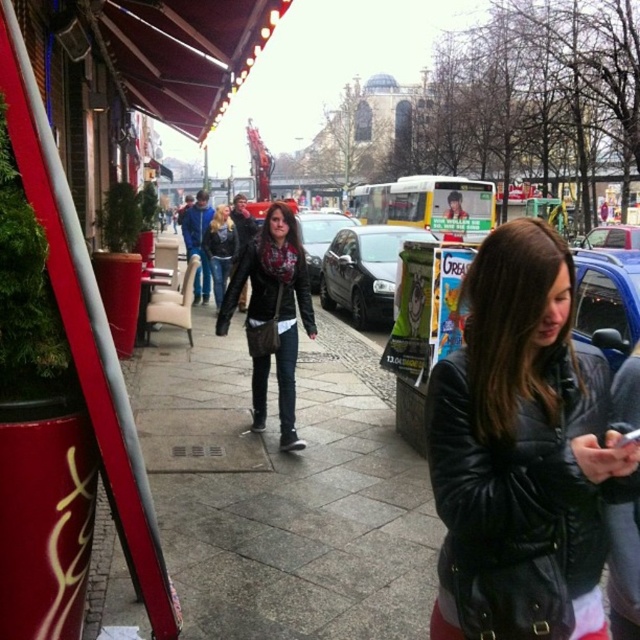
Does matte black scarf at center have a smaller size compared to shiny black car at center?

Correct, matte black scarf at center occupies less space than shiny black car at center.

What do you see at coordinates (273, 312) in the screenshot? I see `matte black scarf at center` at bounding box center [273, 312].

Image resolution: width=640 pixels, height=640 pixels. Describe the element at coordinates (273, 312) in the screenshot. I see `matte black scarf at center` at that location.

Where is `matte black scarf at center`? The image size is (640, 640). matte black scarf at center is located at coordinates pyautogui.click(x=273, y=312).

The height and width of the screenshot is (640, 640). Identify the location of matte black scarf at center. (273, 312).

Which is behind, point (253, 269) or point (211, 262)?

Point (211, 262)

Which is in front, point (260, 272) or point (232, 224)?

Point (260, 272) is more forward.

Identify the location of matte black scarf at center. This screenshot has width=640, height=640. (273, 312).

Find the location of a particular element. matte black jacket at center is located at coordinates (220, 250).

Is point (205, 252) positioned before point (330, 232)?

Yes, it is.

Locate an element on the screen. matte black jacket at center is located at coordinates (220, 250).